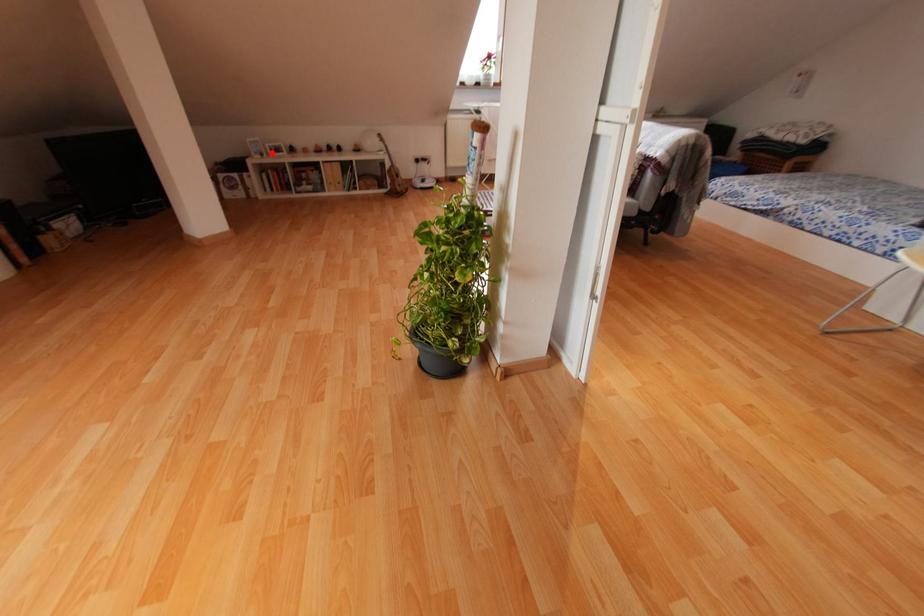
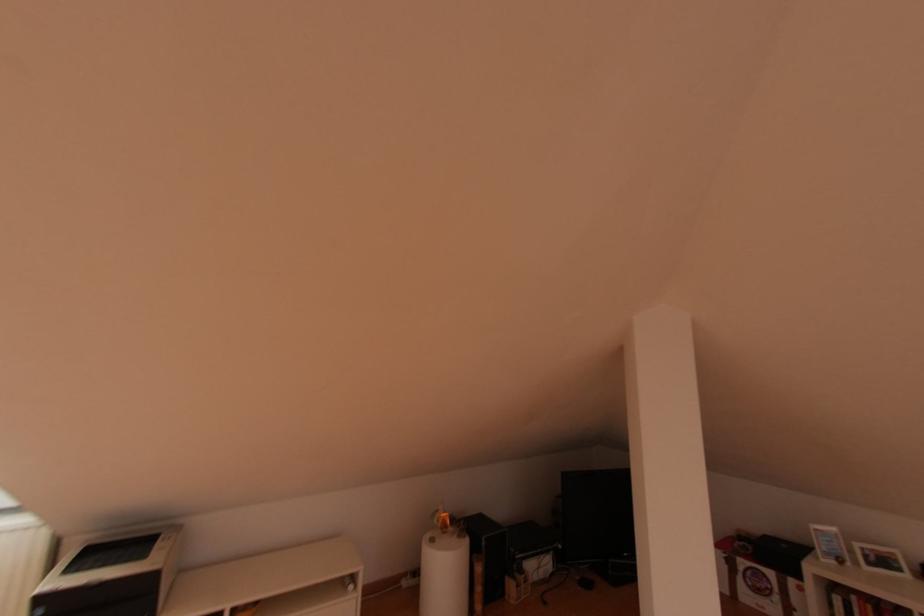
Question: A red point is marked in image1. In image2, is the corresponding 3D point closer to the camera or farther? Reply with the corresponding letter.

Choices:
 (A) The corresponding 3D point is closer.
 (B) The corresponding 3D point is farther.

Answer: (A)